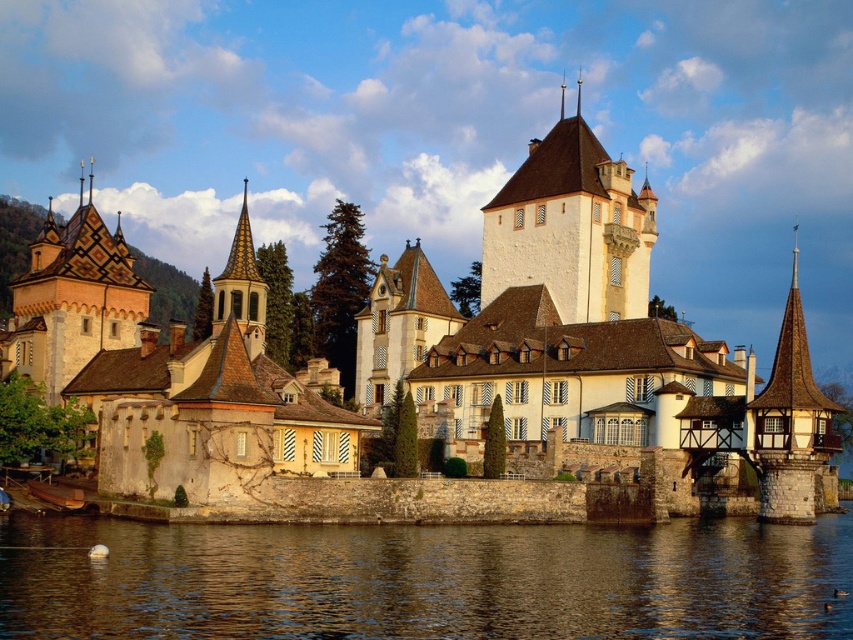
Question: Does white stone tower at upper center appear over smooth gray steeple at center?

Choices:
 (A) no
 (B) yes

Answer: (B)

Question: Which point appears closest to the camera in this image?

Choices:
 (A) 97,323
 (B) 601,268

Answer: (A)

Question: Based on their relative distances, which object is nearer to the brown water at lower center?

Choices:
 (A) white stone castle at center
 (B) smooth gray steeple at center

Answer: (A)

Question: Does white stone castle at center have a lesser width compared to brown water at lower center?

Choices:
 (A) no
 (B) yes

Answer: (A)

Question: Does white stone castle at center appear on the right side of brown water at lower center?

Choices:
 (A) yes
 (B) no

Answer: (B)

Question: Which is farther from the white stone castle at center?

Choices:
 (A) white stone tower at upper center
 (B) brown water at lower center
 (C) smooth gray steeple at center

Answer: (C)